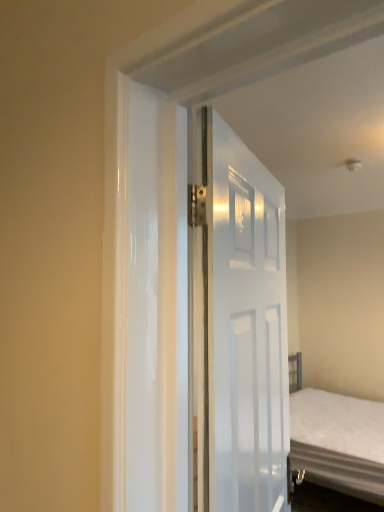
Question: Choose the correct answer: Is white glossy door at center inside white fabric bed at center or outside it?

Choices:
 (A) inside
 (B) outside

Answer: (B)

Question: In terms of height, does white glossy door at center look taller or shorter compared to white fabric bed at center?

Choices:
 (A) tall
 (B) short

Answer: (A)

Question: In terms of width, does white glossy door at center look wider or thinner when compared to white fabric bed at center?

Choices:
 (A) thin
 (B) wide

Answer: (A)

Question: Considering the relative positions of white fabric bed at center and white glossy door at center in the image provided, is white fabric bed at center to the left or to the right of white glossy door at center?

Choices:
 (A) right
 (B) left

Answer: (A)

Question: Does point (332, 480) appear closer or farther from the camera than point (198, 443)?

Choices:
 (A) farther
 (B) closer

Answer: (A)

Question: From a real-world perspective, is white fabric bed at center physically located above or below white glossy door at center?

Choices:
 (A) above
 (B) below

Answer: (B)

Question: Relative to white glossy door at center, is white fabric bed at center in front or behind?

Choices:
 (A) behind
 (B) front

Answer: (A)